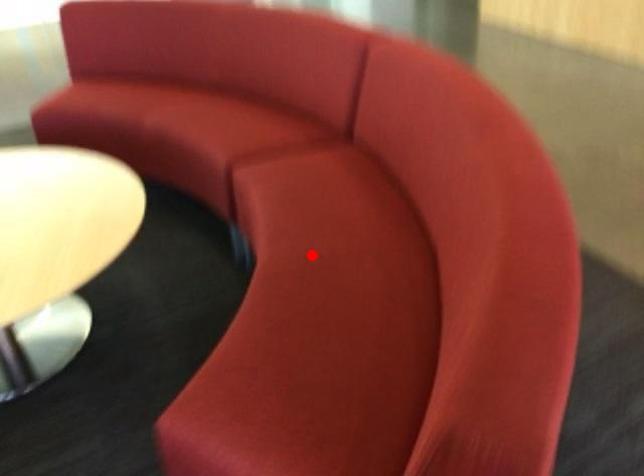
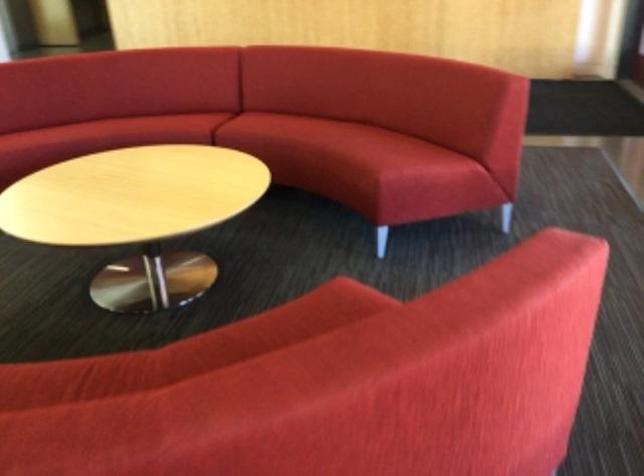
Question: I am providing you with two images of the same scene from different viewpoints. A red point is marked on the first image. At the location where the point appears in image 1, is it still visible in image 2?

Choices:
 (A) Yes
 (B) No

Answer: (A)